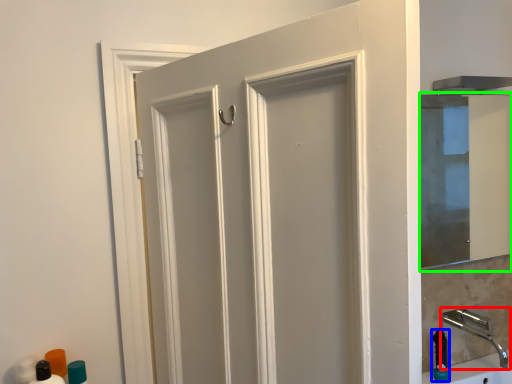
Question: Considering the real-world distances, which object is closest to tap (highlighted by a red box)? soap dispenser (highlighted by a blue box) or mirror (highlighted by a green box).

Choices:
 (A) soap dispenser
 (B) mirror

Answer: (A)